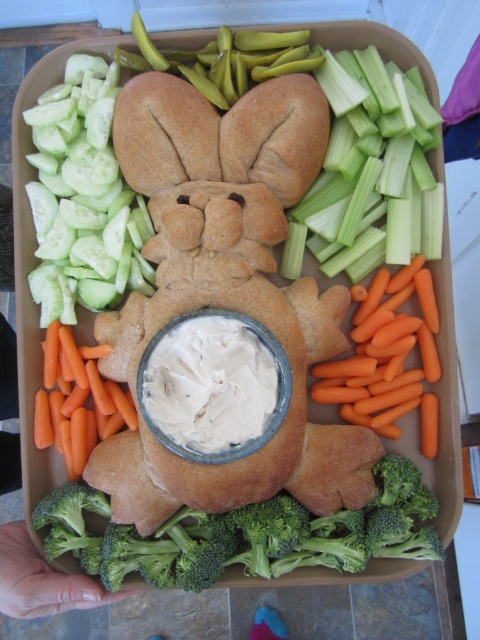
Question: Among these objects, which one is farthest from the camera?

Choices:
 (A) green celery at upper right
 (B) bread at center

Answer: (A)

Question: Does green broccoli at bottom have a lesser width compared to orange smooth carrot at center?

Choices:
 (A) yes
 (B) no

Answer: (B)

Question: From the image, what is the correct spatial relationship of green celery at upper right in relation to orange smooth carrot at lower right?

Choices:
 (A) right
 (B) left

Answer: (B)

Question: Which point is farther to the camera?

Choices:
 (A) (183, 444)
 (B) (362, 369)
 (C) (63, 317)

Answer: (C)

Question: Which point is farther from the camera taking this photo?

Choices:
 (A) pyautogui.click(x=298, y=198)
 (B) pyautogui.click(x=94, y=102)
 (C) pyautogui.click(x=416, y=136)
 (D) pyautogui.click(x=427, y=413)

Answer: (B)

Question: Does green cucumber at upper left appear on the left side of orange smooth carrot at lower right?

Choices:
 (A) yes
 (B) no

Answer: (A)